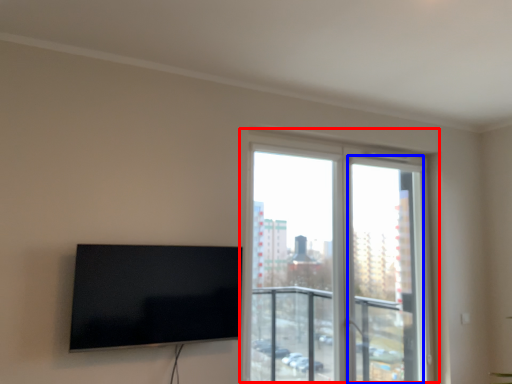
Question: Which object appears farthest to the camera in this image, window (highlighted by a red box) or screen door (highlighted by a blue box)?

Choices:
 (A) window
 (B) screen door

Answer: (B)